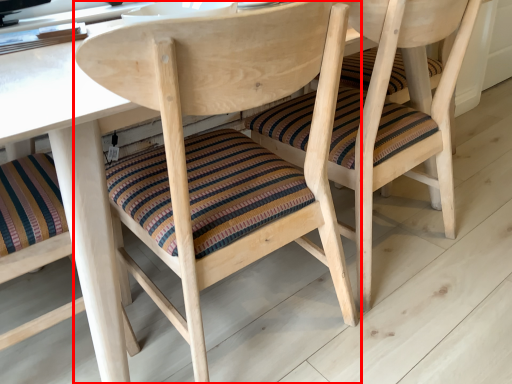
Question: Considering the relative positions of chair (annotated by the red box) and chair in the image provided, where is chair (annotated by the red box) located with respect to the staircase?

Choices:
 (A) right
 (B) left

Answer: (B)